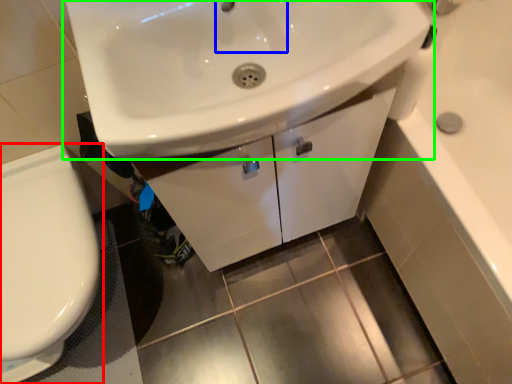
Question: Based on their relative distances, which object is nearer to toilet (highlighted by a red box)? Choose from faucet (highlighted by a blue box) and sink (highlighted by a green box).

Choices:
 (A) faucet
 (B) sink

Answer: (B)